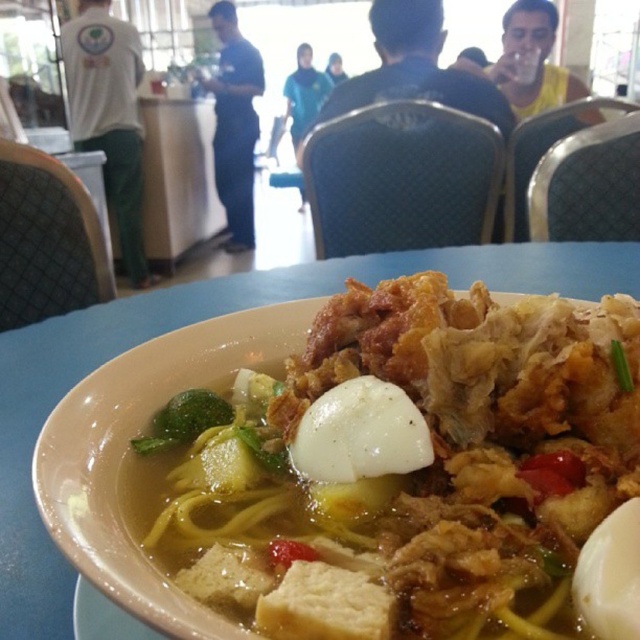
You are a food critic who needs to describe the arrangement of the white matte egg at center and the green leafy vegetable at center in the bowl. How far apart are they?

The white matte egg at center and the green leafy vegetable at center are 12.35 inches apart.

You are a food critic evaluating this dish. You need to describe the position of the white smooth egg at center relative to the green leafy vegetable at center in the bowl. What do you observe?

The white smooth egg at center is positioned above the green leafy vegetable at center in the bowl.

Consider the image. You are a food critic evaluating the placement of ingredients in the dish. The white matte egg at center is part of your assessment. Based on its position, can you determine if it is placed near the edge of the bowl?

The white matte egg at center is located at point coordinates that are very close to the edge of the bowl, specifically at position 0.955 on the y axis, which suggests it is near the edge.